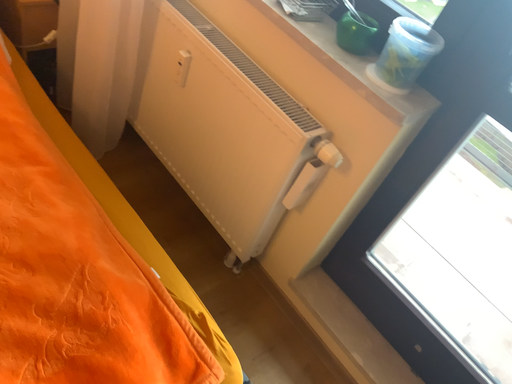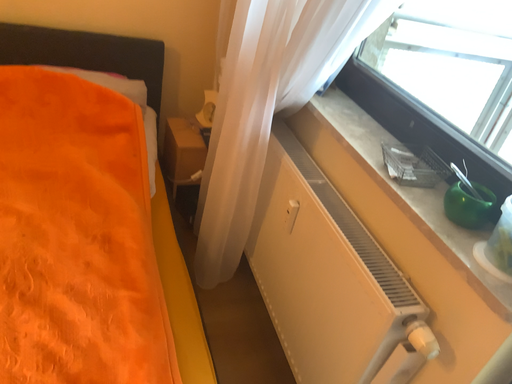
Question: How did the camera likely rotate when shooting the video?

Choices:
 (A) rotated right
 (B) rotated left

Answer: (B)